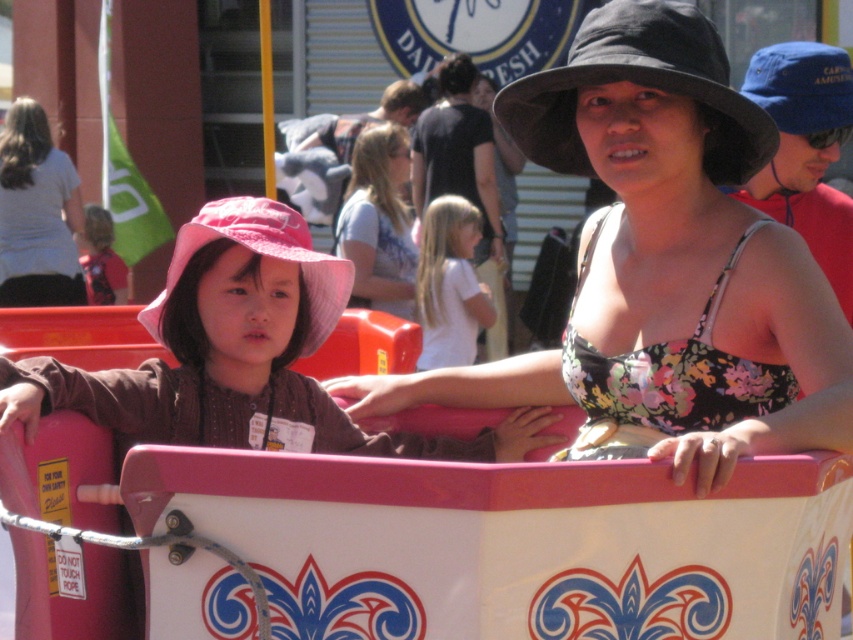
Question: Is the position of pink fabric hat at center more distant than that of white cotton shirt at center?

Choices:
 (A) yes
 (B) no

Answer: (B)

Question: Is black fabric hat at upper center below blue fabric hat at upper right?

Choices:
 (A) no
 (B) yes

Answer: (B)

Question: Estimate the real-world distances between objects in this image. Which object is farther from the blue fabric hat at upper right?

Choices:
 (A) floral fabric tank top at center
 (B) white cotton shirt at center

Answer: (B)

Question: Which point is closer to the camera taking this photo?

Choices:
 (A) (49, 184)
 (B) (780, 90)
 (C) (569, 76)

Answer: (C)

Question: Is floral fabric tank top at center bigger than blue fabric hat at upper right?

Choices:
 (A) yes
 (B) no

Answer: (A)

Question: Which object is positioned closest to the black fabric hat at upper center?

Choices:
 (A) light blue denim shirt at center
 (B) white cotton shirt at center

Answer: (B)